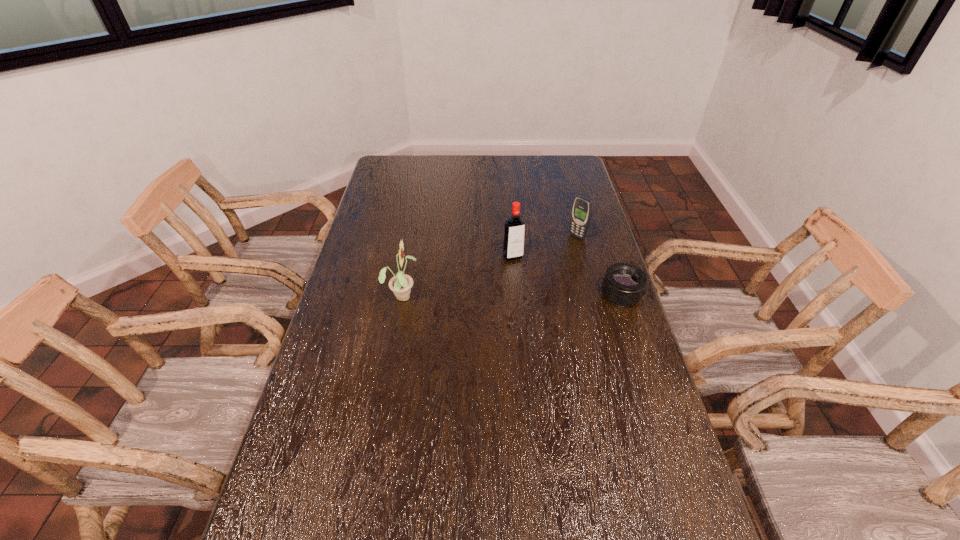
Identify the location of the leftmost object. (401, 284).

The width and height of the screenshot is (960, 540). In order to click on the shortest object in this screenshot , I will do `click(624, 284)`.

The height and width of the screenshot is (540, 960). I want to click on cellular telephone, so click(582, 208).

Find the location of a particular element. The width and height of the screenshot is (960, 540). the farthest object is located at coordinates (582, 208).

Identify the location of the second farthest object. (514, 233).

Find the location of a particular element. The height and width of the screenshot is (540, 960). vodka is located at coordinates (514, 233).

Where is `free region located 0.390m on the front-facing side of the sunflower`? This screenshot has height=540, width=960. free region located 0.390m on the front-facing side of the sunflower is located at coordinates (538, 295).

Identify the location of vacant point located 0.340m on the screen of the cellular telephone. Image resolution: width=960 pixels, height=540 pixels. (513, 285).

Where is `vacant space located on the screen of the cellular telephone`? Image resolution: width=960 pixels, height=540 pixels. vacant space located on the screen of the cellular telephone is located at coordinates (553, 254).

At what (x,y) coordinates should I click in order to perform the action: click on free space located on the screen of the cellular telephone. Please return your answer as a coordinate pair (x, y). The height and width of the screenshot is (540, 960). Looking at the image, I should click on (516, 282).